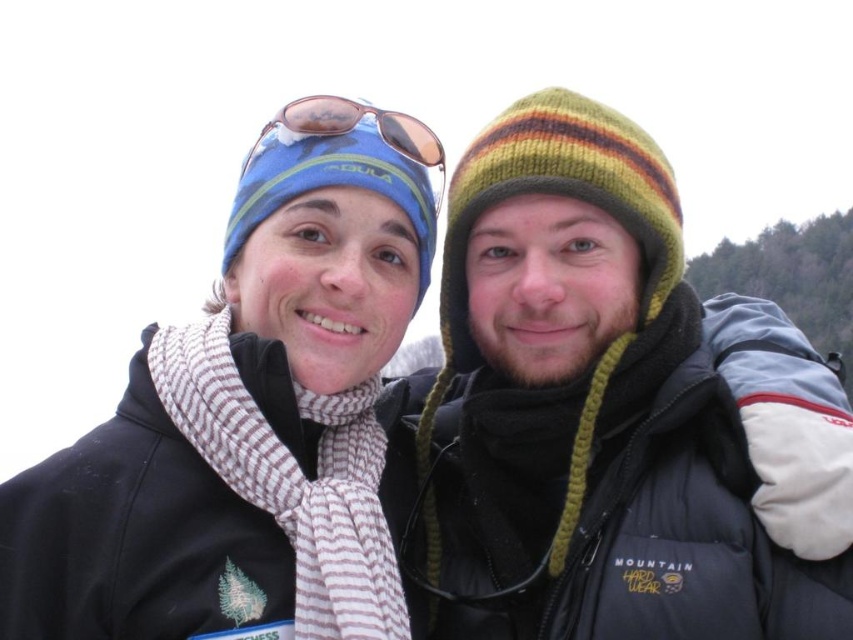
Question: Considering the real-world distances, which object is farthest from the sunglasses at upper center?

Choices:
 (A) knitted woolen beanie at right
 (B) white striped scarf at center

Answer: (B)

Question: Does white striped scarf at center appear under sunglasses at upper center?

Choices:
 (A) yes
 (B) no

Answer: (A)

Question: Is white striped scarf at center smaller than sunglasses at upper center?

Choices:
 (A) no
 (B) yes

Answer: (B)

Question: Based on their relative distances, which object is farther from the sunglasses at upper center?

Choices:
 (A) knitted woolen beanie at right
 (B) white striped scarf at center

Answer: (B)

Question: Does white striped scarf at center have a greater width compared to sunglasses at upper center?

Choices:
 (A) yes
 (B) no

Answer: (B)

Question: Among these points, which one is nearest to the camera?

Choices:
 (A) (314, 529)
 (B) (425, 138)
 (C) (575, 492)

Answer: (A)